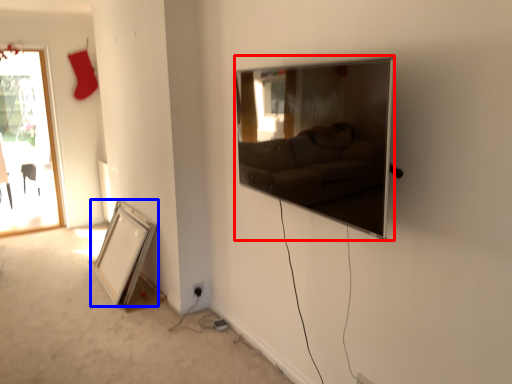
Question: Among these objects, which one is nearest to the camera, picture frame (highlighted by a red box) or picture frame (highlighted by a blue box)?

Choices:
 (A) picture frame
 (B) picture frame

Answer: (A)